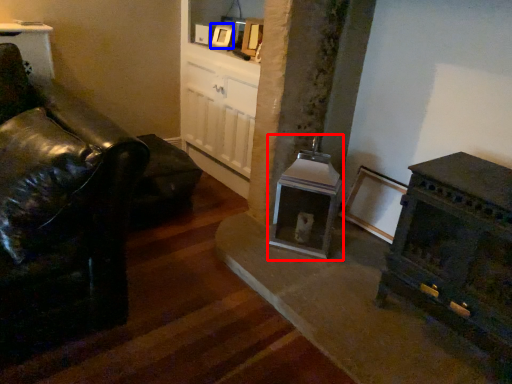
Question: Which object appears farthest to the camera in this image, fireplace (highlighted by a red box) or picture frame (highlighted by a blue box)?

Choices:
 (A) fireplace
 (B) picture frame

Answer: (B)